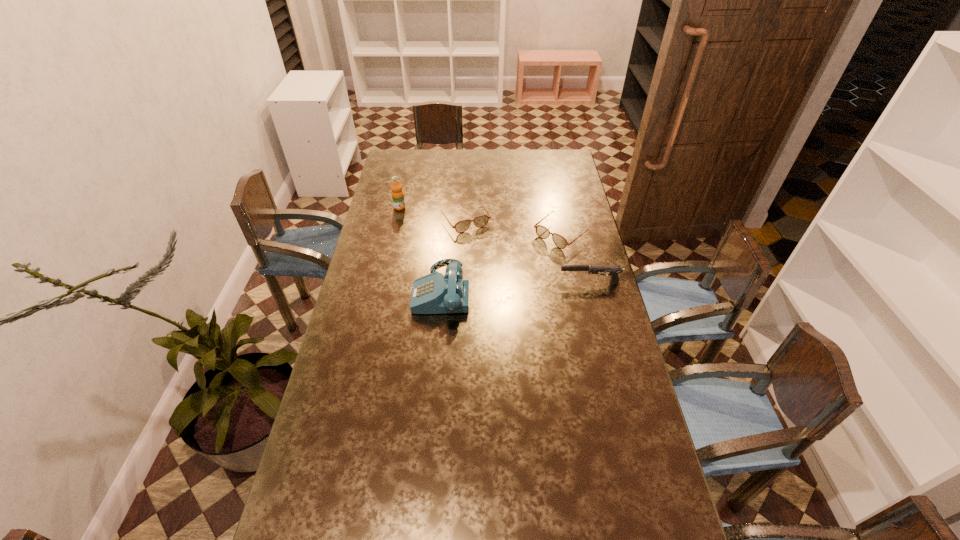
Find the location of `free spot located on the front-facing side of the right sunglasses`. free spot located on the front-facing side of the right sunglasses is located at coordinates (480, 299).

Where is `object that is at the left edge`? object that is at the left edge is located at coordinates (397, 193).

At what (x,y) coordinates should I click in order to perform the action: click on gun positioned at the right edge. Please return your answer as a coordinate pair (x, y). The height and width of the screenshot is (540, 960). Looking at the image, I should click on (614, 270).

Where is `sunglasses at the right edge`? This screenshot has height=540, width=960. sunglasses at the right edge is located at coordinates (542, 232).

Locate an element on the screen. The width and height of the screenshot is (960, 540). free region at the far edge of the desktop is located at coordinates (474, 168).

What are the coordinates of `vacant space at the left edge of the desktop` in the screenshot? It's located at (402, 179).

What are the coordinates of `free region at the right edge of the desktop` in the screenshot? It's located at (551, 224).

Locate an element on the screen. This screenshot has height=540, width=960. vacant space at the far right corner of the desktop is located at coordinates (542, 157).

Where is `unoccupied area between the right sunglasses and the third shortest object`? The width and height of the screenshot is (960, 540). unoccupied area between the right sunglasses and the third shortest object is located at coordinates (576, 258).

You are a GUI agent. You are given a task and a screenshot of the screen. Output one action in this format:
    pyautogui.click(x=<x>, y=<y>)
    Task: Click on the free spot between the right sunglasses and the left sunglasses
    
    Given the screenshot: What is the action you would take?
    pyautogui.click(x=514, y=226)